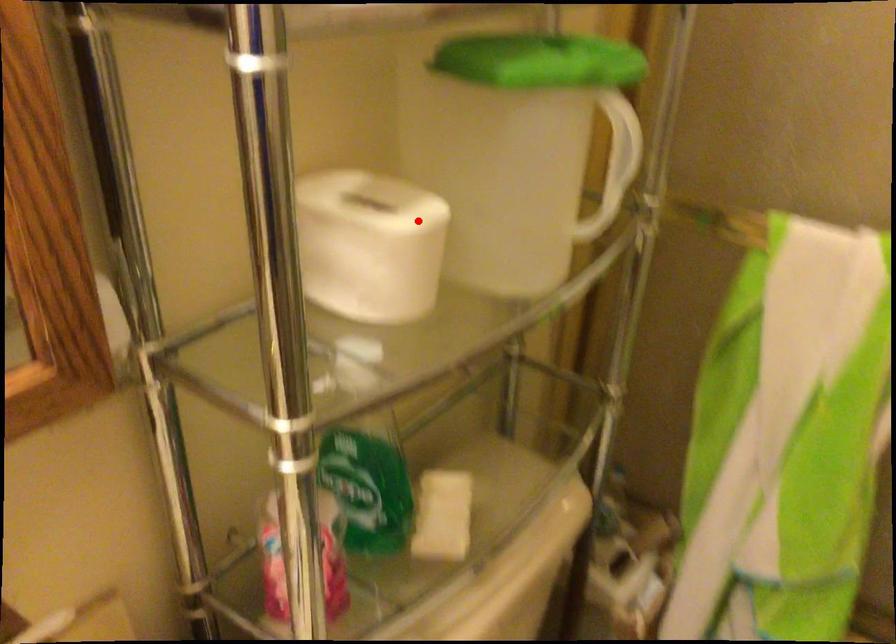
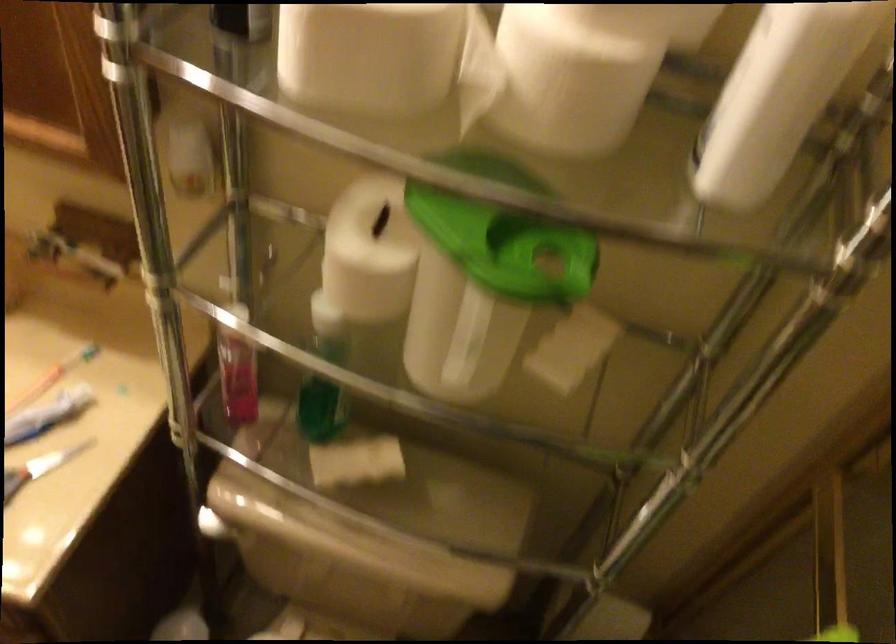
Question: I am providing you with two images of the same scene from different viewpoints. In image1, a red point is highlighted. Considering the same 3D point in image2, which of the following is correct?

Choices:
 (A) It is closer
 (B) It is farther

Answer: (B)